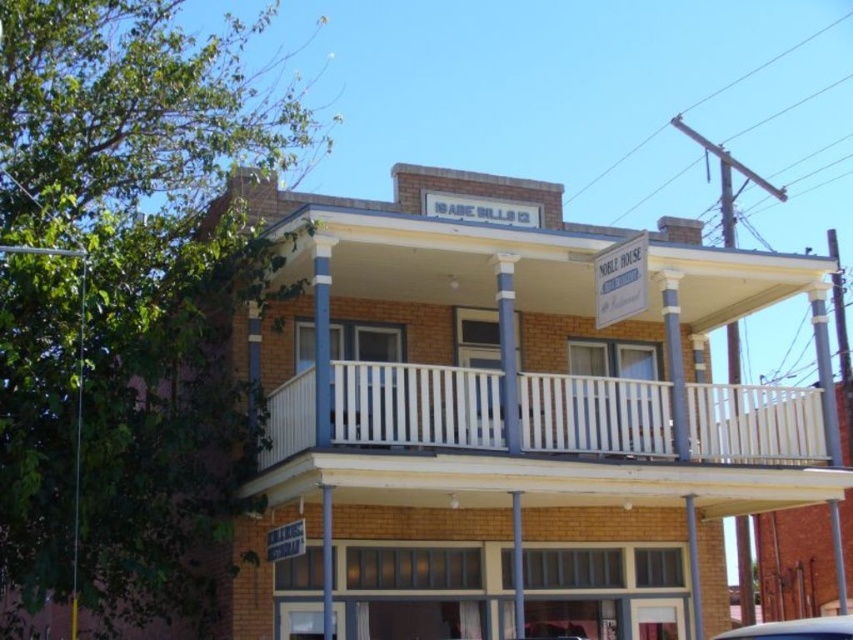
You are a delivery person needing to park your white glossy car at lower right near the metallic silver sign at lower center. Considering their heights, will the car block the visibility of the sign when parked there?

The white glossy car at lower right is taller than the metallic silver sign at lower center, so parking the car near the sign would block its visibility since the car is taller.

You are a delivery person trying to park your white glossy car at lower right near the metallic silver sign at lower center. Based on the scene, can you park your car in front of the sign without blocking the entrance of the building?

The white glossy car at lower right is closer to the viewer than the metallic silver sign at lower center, so parking the car in front of the sign would block the entrance of the building.

You are standing in front of the building and want to reach the point marked as point (842, 637). Considering the distance, would you need to walk more than 25 feet to get there?

The distance between you and point (842, 637) is 28.82 feet, so yes, you would need to walk more than 25 feet to reach it.